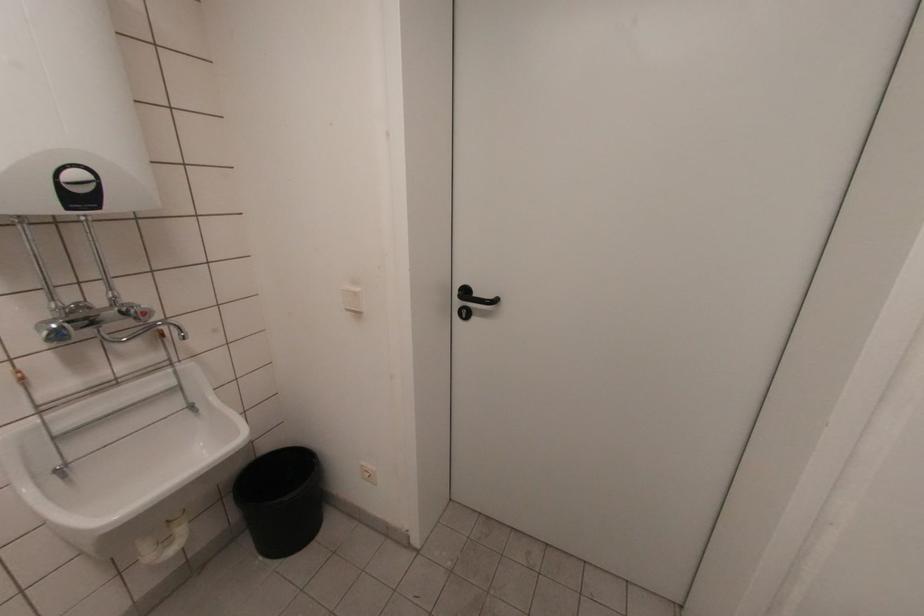
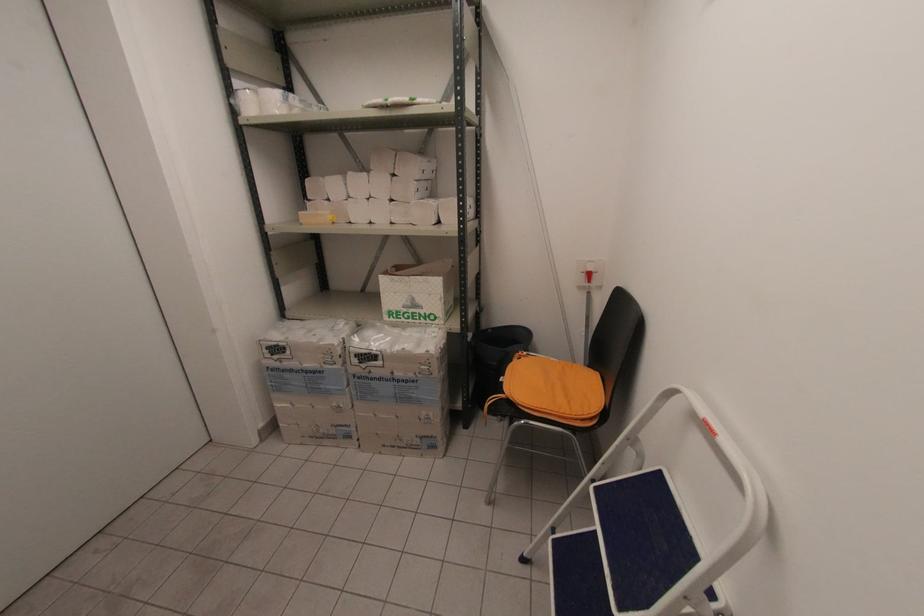
How did the camera likely rotate?

The camera's rotation is toward right-down.